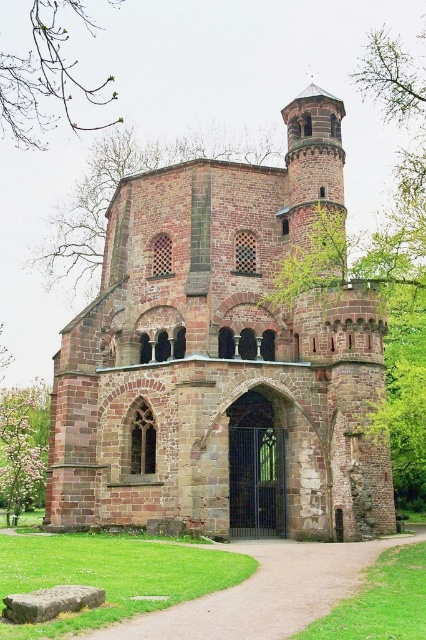
Who is taller, brown stone church at center or green leafy tree at upper center?

brown stone church at center

How far apart are brown stone church at center and green leafy tree at upper center?

They are 46.05 meters apart.

The width and height of the screenshot is (426, 640). I want to click on brown stone church at center, so click(221, 358).

Between green leafy branches at upper left and green leafy tree at lower left, which one has more height?

green leafy branches at upper left

Is green leafy branches at upper left behind green leafy tree at lower left?

No, green leafy branches at upper left is closer to the viewer.

Between point (37, 77) and point (9, 481), which one is positioned in front?

Point (9, 481)

Identify the location of green leafy branches at upper left. This screenshot has height=640, width=426. (46, 77).

Which is in front, point (371, 541) or point (103, 106)?

Point (371, 541) is more forward.

Does dirt/gravel path at center have a lesser width compared to green leafy branches at upper left?

Indeed, dirt/gravel path at center has a lesser width compared to green leafy branches at upper left.

Between point (253, 556) and point (25, 67), which one is positioned behind?

The point (25, 67) is more distant.

Where is `dirt/gravel path at center`? dirt/gravel path at center is located at coordinates (264, 593).